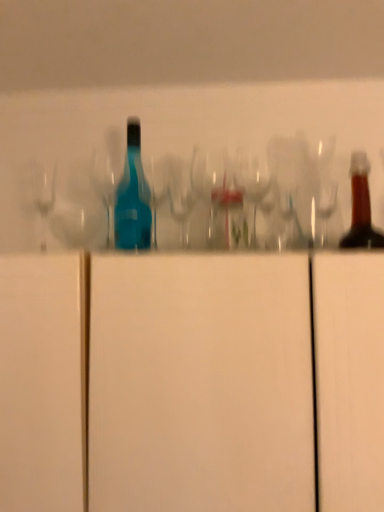
Question: From the image's perspective, is transparent glass shot glass at center located beneath clear glass wine glass at center?

Choices:
 (A) yes
 (B) no

Answer: (B)

Question: Can you confirm if transparent glass shot glass at center is thinner than clear glass wine glass at center?

Choices:
 (A) yes
 (B) no

Answer: (B)

Question: From a real-world perspective, is transparent glass shot glass at center over clear glass wine glass at center?

Choices:
 (A) yes
 (B) no

Answer: (A)

Question: Would you say transparent glass shot glass at center is outside clear glass wine glass at center?

Choices:
 (A) yes
 (B) no

Answer: (A)

Question: Is the depth of transparent glass shot glass at center greater than that of clear glass wine glass at center?

Choices:
 (A) yes
 (B) no

Answer: (A)

Question: Can you confirm if transparent glass shot glass at center is positioned to the right of clear glass wine glass at center?

Choices:
 (A) no
 (B) yes

Answer: (A)

Question: Considering the relative sizes of white matte cabinet at center and transparent glass shot glass at center in the image provided, is white matte cabinet at center bigger than transparent glass shot glass at center?

Choices:
 (A) yes
 (B) no

Answer: (A)

Question: From a real-world perspective, is white matte cabinet at center on transparent glass shot glass at center?

Choices:
 (A) no
 (B) yes

Answer: (A)

Question: From the image's perspective, does white matte cabinet at center appear lower than transparent glass shot glass at center?

Choices:
 (A) no
 (B) yes

Answer: (B)

Question: Is white matte cabinet at center next to transparent glass shot glass at center and touching it?

Choices:
 (A) no
 (B) yes

Answer: (A)

Question: From a real-world perspective, is white matte cabinet at center located beneath transparent glass shot glass at center?

Choices:
 (A) yes
 (B) no

Answer: (A)

Question: Is white matte cabinet at center not within transparent glass shot glass at center?

Choices:
 (A) no
 (B) yes

Answer: (B)

Question: Is white matte cabinet at center facing away from clear glass wine glass at center?

Choices:
 (A) no
 (B) yes

Answer: (A)